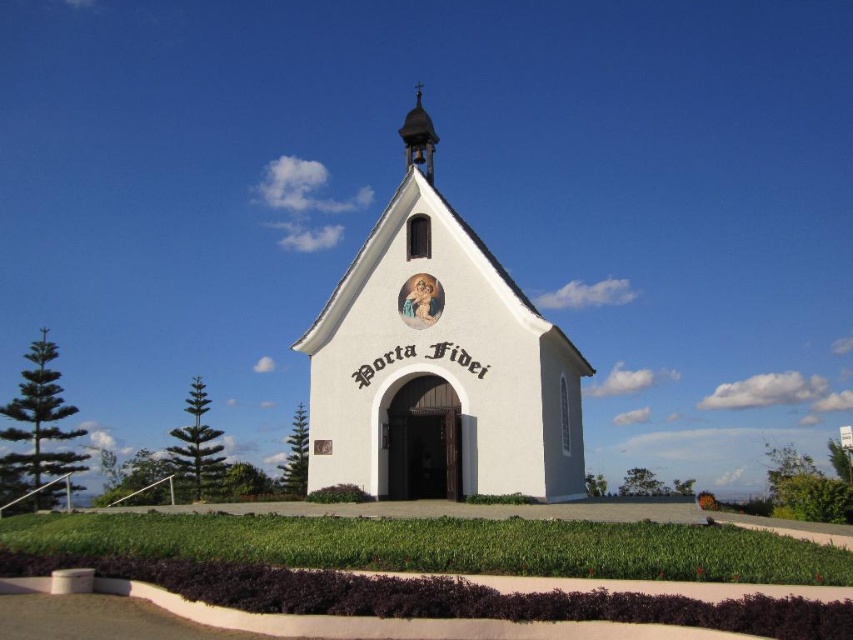
Question: Which point is closer to the camera?

Choices:
 (A) (426, 128)
 (B) (474, 259)

Answer: (B)

Question: Can you confirm if white painted wood chapel at center is wider than shiny gold spire at upper center?

Choices:
 (A) no
 (B) yes

Answer: (B)

Question: Can you confirm if white painted wood chapel at center is positioned to the left of shiny gold spire at upper center?

Choices:
 (A) yes
 (B) no

Answer: (B)

Question: Among these points, which one is farthest from the camera?

Choices:
 (A) (508, 284)
 (B) (416, 99)

Answer: (B)

Question: Does white painted wood chapel at center appear under shiny gold spire at upper center?

Choices:
 (A) yes
 (B) no

Answer: (A)

Question: Which of the following is the farthest from the observer?

Choices:
 (A) white painted wood chapel at center
 (B) shiny gold spire at upper center

Answer: (B)